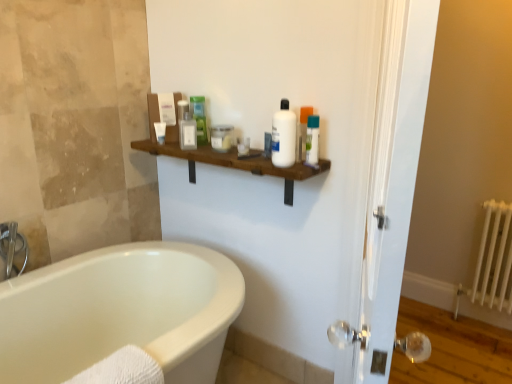
You are a GUI agent. You are given a task and a screenshot of the screen. Output one action in this format:
    pyautogui.click(x=<x>, y=<y>)
    Task: Click on the vacant area that is in front of white metal radiator at right
    
    Given the screenshot: What is the action you would take?
    pyautogui.click(x=486, y=350)